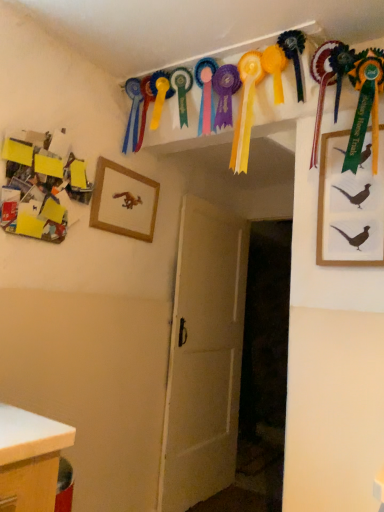
Image resolution: width=384 pixels, height=512 pixels. What do you see at coordinates (204, 356) in the screenshot?
I see `white wooden door at center` at bounding box center [204, 356].

From the picture: Measure the distance between point (152, 216) and camera.

Point (152, 216) and camera are 7.93 feet apart from each other.

Describe the element at coordinates (30, 459) in the screenshot. I see `white matte desk at lower left` at that location.

In order to click on yellow paper collage at upper left in this screenshot , I will do `click(41, 185)`.

The height and width of the screenshot is (512, 384). Find the location of `white wooden door at center`. white wooden door at center is located at coordinates (204, 356).

What are the coordinates of `desk in front of the yellow paper collage at upper left` in the screenshot? It's located at (30, 459).

What's the angular difference between yellow paper collage at upper left and white matte desk at lower left's facing directions?

The facing directions of yellow paper collage at upper left and white matte desk at lower left are 2.67 degrees apart.

Who is taller, yellow paper collage at upper left or white matte desk at lower left?

yellow paper collage at upper left is taller.

Is yellow paper collage at upper left placed right next to white matte desk at lower left?

There is a gap between yellow paper collage at upper left and white matte desk at lower left.

Can you see wooden picture frame at center-left, arranged as the 1th picture frame when viewed from the left, touching white wooden door at center?

wooden picture frame at center-left, arranged as the 1th picture frame when viewed from the left, is not next to white wooden door at center, and they're not touching.

What's the angular difference between wooden picture frame at center-left, arranged as the second picture frame when viewed from the right, and white wooden door at center's facing directions?

wooden picture frame at center-left, arranged as the second picture frame when viewed from the right, and white wooden door at center are facing 0.634 degrees away from each other.

Which is behind, point (152, 184) or point (175, 479)?

The point (175, 479) is farther from the camera.

Measure the distance between wooden picture frame at center-left, which is the 2th picture frame in front-to-back order, and white wooden door at center.

wooden picture frame at center-left, which is the 2th picture frame in front-to-back order, and white wooden door at center are 30.79 inches apart.

From the picture: Is white wooden door at center not near wooden picture frame at center-left, which is the 2th picture frame in front-to-back order?

No, white wooden door at center is not far away from wooden picture frame at center-left, which is the 2th picture frame in front-to-back order.

How much distance is there between white wooden door at center and wooden picture frame at center-left, which is the 1th picture frame from back to front?

white wooden door at center and wooden picture frame at center-left, which is the 1th picture frame from back to front, are 30.79 inches apart from each other.

Can you confirm if white wooden door at center is shorter than wooden picture frame at center-left, arranged as the second picture frame when viewed from the right?

No.

From the image's perspective, would you say white wooden door at center is shown under wooden picture frame at center-left, arranged as the 1th picture frame when viewed from the left?

Yes, from the image's perspective, white wooden door at center is below wooden picture frame at center-left, arranged as the 1th picture frame when viewed from the left.

Is silk green ribbon at upper right, arranged as the 1th picture frame when viewed from the right, at the back of wooden picture frame at center-left, arranged as the 1th picture frame when viewed from the left?

No, wooden picture frame at center-left, arranged as the 1th picture frame when viewed from the left, is not facing away from silk green ribbon at upper right, arranged as the 1th picture frame when viewed from the right.

Looking at this image, are wooden picture frame at center-left, which is the 1th picture frame from back to front, and silk green ribbon at upper right, placed as the first picture frame when sorted from front to back, making contact?

There is a gap between wooden picture frame at center-left, which is the 1th picture frame from back to front, and silk green ribbon at upper right, placed as the first picture frame when sorted from front to back.

Does wooden picture frame at center-left, which is the 2th picture frame in front-to-back order, have a smaller size compared to silk green ribbon at upper right, the second picture frame viewed from the left?

Correct, wooden picture frame at center-left, which is the 2th picture frame in front-to-back order, occupies less space than silk green ribbon at upper right, the second picture frame viewed from the left.

Consider the image. Between silk green ribbon at upper right, arranged as the 1th picture frame when viewed from the right, and white wooden door at center, which one appears on the right side from the viewer's perspective?

Positioned to the right is silk green ribbon at upper right, arranged as the 1th picture frame when viewed from the right.

Is white wooden door at center completely or partially inside silk green ribbon at upper right, the second picture frame viewed from the left?

No, white wooden door at center is not inside silk green ribbon at upper right, the second picture frame viewed from the left.

Does point (370, 139) lie behind point (219, 420)?

No, (370, 139) is closer to viewer.

In the image, is silk green ribbon at upper right, placed as the first picture frame when sorted from front to back, positioned in front of or behind white wooden door at center?

silk green ribbon at upper right, placed as the first picture frame when sorted from front to back, is positioned closer to the viewer than white wooden door at center.

Between white matte desk at lower left and silk green ribbon at upper right, placed as the first picture frame when sorted from front to back, which one has larger size?

white matte desk at lower left.

In the scene shown: Can you tell me how much white matte desk at lower left and silk green ribbon at upper right, the second picture frame viewed from the left, differ in facing direction?

86.7 degrees separate the facing orientations of white matte desk at lower left and silk green ribbon at upper right, the second picture frame viewed from the left.

Is white matte desk at lower left not within silk green ribbon at upper right, arranged as the 1th picture frame when viewed from the right?

white matte desk at lower left is positioned outside silk green ribbon at upper right, arranged as the 1th picture frame when viewed from the right.

Would you say white matte desk at lower left is a long distance from silk green ribbon at upper right, which ranks as the second picture frame in back-to-front order?

Yes, white matte desk at lower left and silk green ribbon at upper right, which ranks as the second picture frame in back-to-front order, are located far from each other.

Are white wooden door at center and silk green ribbon at upper right, which ranks as the second picture frame in back-to-front order, making contact?

white wooden door at center and silk green ribbon at upper right, which ranks as the second picture frame in back-to-front order, are not in contact.

Is point (201, 213) closer or farther from the camera than point (356, 246)?

Clearly, point (201, 213) is more distant from the camera than point (356, 246).

Is white wooden door at center situated inside silk green ribbon at upper right, arranged as the 1th picture frame when viewed from the right, or outside?

white wooden door at center exists outside the volume of silk green ribbon at upper right, arranged as the 1th picture frame when viewed from the right.

Considering the positions of objects white wooden door at center and silk green ribbon at upper right, the second picture frame viewed from the left, in the image provided, who is behind, white wooden door at center or silk green ribbon at upper right, the second picture frame viewed from the left,?

Positioned behind is white wooden door at center.

Image resolution: width=384 pixels, height=512 pixels. I want to click on desk that appears on the right of yellow paper collage at upper left, so click(30, 459).

Find the location of a particular element. Image resolution: width=384 pixels, height=512 pixels. picture frame that is the 2nd one when counting upward from the white wooden door at center (from the image's perspective) is located at coordinates (123, 201).

When comparing their distances from wooden picture frame at center-left, which is the 2th picture frame in front-to-back order, does silk green ribbon at upper right, placed as the first picture frame when sorted from front to back, or white wooden door at center seem closer?

Based on the image, white wooden door at center appears to be nearer to wooden picture frame at center-left, which is the 2th picture frame in front-to-back order.

Looking at the image, which one is located further to white wooden door at center, silk green ribbon at upper right, the second picture frame viewed from the left, or yellow paper collage at upper left?

silk green ribbon at upper right, the second picture frame viewed from the left.

Considering their positions, is white wooden door at center positioned further to wooden picture frame at center-left, which is the 2th picture frame in front-to-back order, than yellow paper collage at upper left?

The object further to wooden picture frame at center-left, which is the 2th picture frame in front-to-back order, is white wooden door at center.

Based on their spatial positions, is wooden picture frame at center-left, arranged as the 1th picture frame when viewed from the left, or silk green ribbon at upper right, placed as the first picture frame when sorted from front to back, closer to white wooden door at center?

The object closer to white wooden door at center is wooden picture frame at center-left, arranged as the 1th picture frame when viewed from the left.

Which object lies nearer to the anchor point silk green ribbon at upper right, the second picture frame viewed from the left, yellow paper collage at upper left or wooden picture frame at center-left, arranged as the second picture frame when viewed from the right?

wooden picture frame at center-left, arranged as the second picture frame when viewed from the right.

From the image, which object appears to be nearer to silk green ribbon at upper right, the second picture frame viewed from the left, wooden picture frame at center-left, which is the 1th picture frame from back to front, or white matte desk at lower left?

Based on the image, wooden picture frame at center-left, which is the 1th picture frame from back to front, appears to be nearer to silk green ribbon at upper right, the second picture frame viewed from the left.

Looking at the image, which one is located further to white wooden door at center, wooden picture frame at center-left, which is the 2th picture frame in front-to-back order, or white matte desk at lower left?

white matte desk at lower left.

When comparing their distances from silk green ribbon at upper right, which ranks as the second picture frame in back-to-front order, does yellow paper collage at upper left or white matte desk at lower left seem further?

white matte desk at lower left.

This screenshot has height=512, width=384. Find the location of `door between silk green ribbon at upper right, the second picture frame viewed from the left, and white matte desk at lower left from top to bottom`. door between silk green ribbon at upper right, the second picture frame viewed from the left, and white matte desk at lower left from top to bottom is located at coordinates (204, 356).

You are a GUI agent. You are given a task and a screenshot of the screen. Output one action in this format:
    pyautogui.click(x=<x>, y=<y>)
    Task: Click on the door between yellow paper collage at upper left and silk green ribbon at upper right, which ranks as the second picture frame in back-to-front order, from left to right
    
    Given the screenshot: What is the action you would take?
    pyautogui.click(x=204, y=356)

Find the location of `picture frame between wooden picture frame at center-left, arranged as the second picture frame when viewed from the right, and white wooden door at center, in the vertical direction`. picture frame between wooden picture frame at center-left, arranged as the second picture frame when viewed from the right, and white wooden door at center, in the vertical direction is located at coordinates (349, 207).

You are a GUI agent. You are given a task and a screenshot of the screen. Output one action in this format:
    pyautogui.click(x=<x>, y=<y>)
    Task: Click on the picture frame between wooden picture frame at center-left, arranged as the 1th picture frame when viewed from the left, and white matte desk at lower left in the up-down direction
    The image size is (384, 512).
    Given the screenshot: What is the action you would take?
    point(349,207)